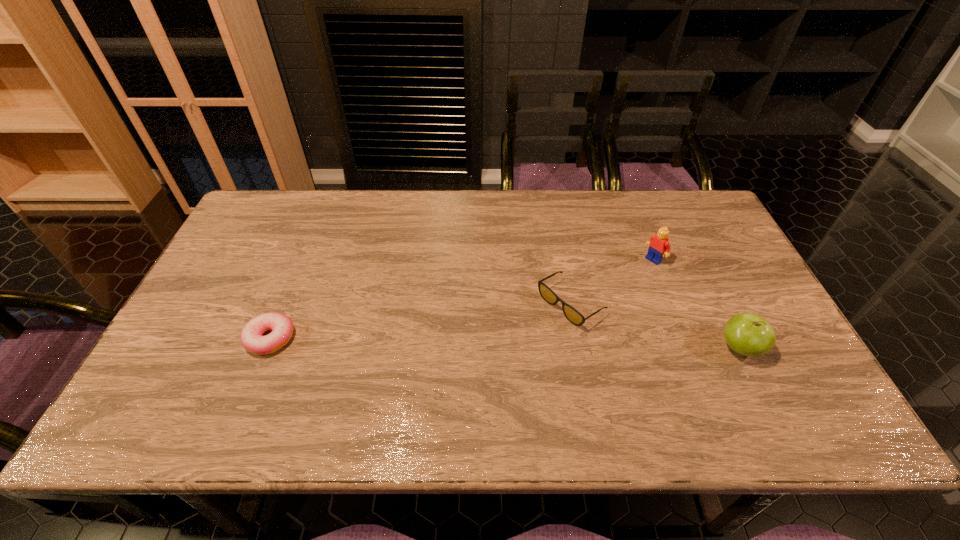
In the image, there is a desktop. Where is `vacant space at the left edge`? The image size is (960, 540). vacant space at the left edge is located at coordinates (228, 261).

This screenshot has width=960, height=540. I want to click on vacant space at the right edge of the desktop, so click(747, 310).

Locate an element on the screen. free space at the near left corner of the desktop is located at coordinates (223, 364).

Identify the location of vacant region at the far right corner. The height and width of the screenshot is (540, 960). (675, 217).

Identify the location of empty location between the second object from right to left and the doughnut. (462, 299).

The image size is (960, 540). Identify the location of free space between the doughnut and the third object from left to right. (462, 299).

The image size is (960, 540). What are the coordinates of `free area in between the apple and the second shortest object` in the screenshot? It's located at (655, 326).

At what (x,y) coordinates should I click in order to perform the action: click on free area in between the apple and the farthest object. Please return your answer as a coordinate pair (x, y). The height and width of the screenshot is (540, 960). Looking at the image, I should click on (696, 304).

Image resolution: width=960 pixels, height=540 pixels. What are the coordinates of `vacant area that lies between the third object from left to right and the rightmost object` in the screenshot? It's located at (696, 304).

Locate an element on the screen. Image resolution: width=960 pixels, height=540 pixels. vacant space that is in between the farthest object and the third tallest object is located at coordinates (612, 282).